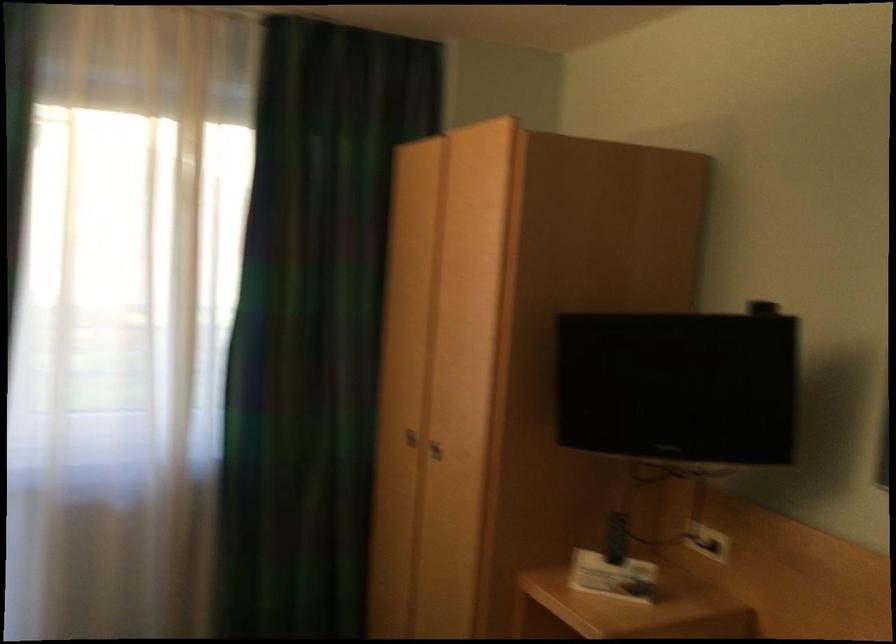
Find where to plugging in the electrical wall outlet. Please return your answer as a coordinate pair (x, y).

(707, 542)